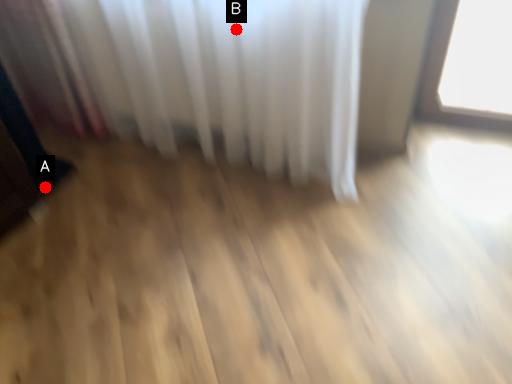
Question: Two points are circled on the image, labeled by A and B beside each circle. Which point is further to the camera?

Choices:
 (A) A is further
 (B) B is further

Answer: (A)